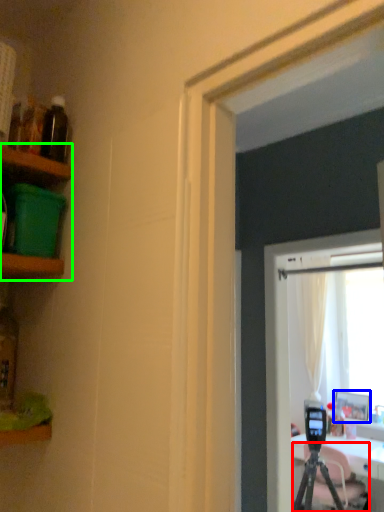
Question: Considering the real-world distances, which object is closest to tripod (highlighted by a red box)? picture frame (highlighted by a blue box) or shelf (highlighted by a green box).

Choices:
 (A) picture frame
 (B) shelf

Answer: (A)